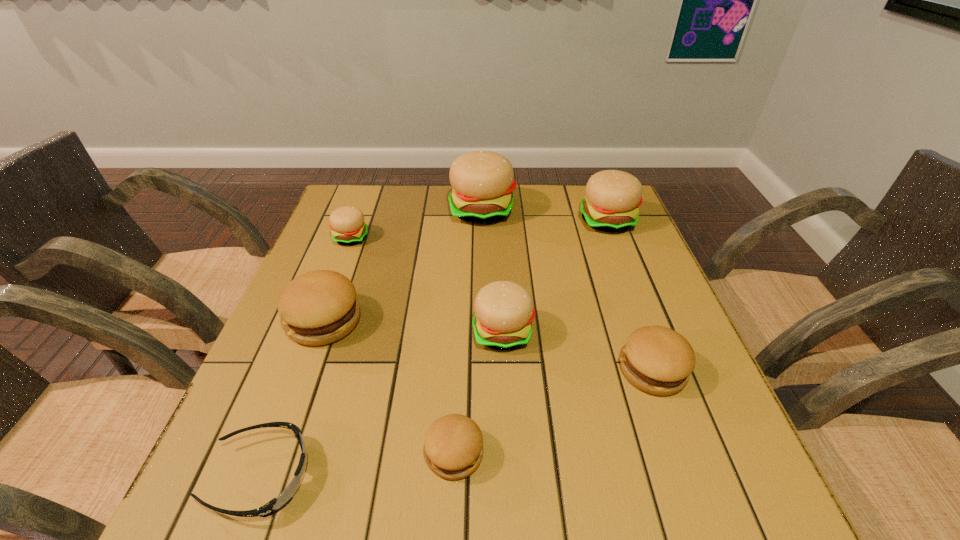
I want to click on sunglasses that is positioned at the near edge, so click(x=276, y=504).

The height and width of the screenshot is (540, 960). Find the location of `sunglasses that is at the left edge`. sunglasses that is at the left edge is located at coordinates (276, 504).

You are a GUI agent. You are given a task and a screenshot of the screen. Output one action in this format:
    pyautogui.click(x=<x>, y=<y>)
    Task: Click on the object that is at the near left corner
    This screenshot has height=540, width=960.
    Given the screenshot: What is the action you would take?
    pyautogui.click(x=276, y=504)

Locate an element on the screen. object positioned at the far right corner is located at coordinates (612, 200).

Locate an element on the screen. vacant region at the far edge of the desktop is located at coordinates (433, 212).

Image resolution: width=960 pixels, height=540 pixels. Find the location of `free region at the near edge`. free region at the near edge is located at coordinates (317, 477).

What are the coordinates of `free space at the left edge` in the screenshot? It's located at (329, 384).

Locate an element on the screen. vacant space at the right edge of the desktop is located at coordinates (646, 258).

You are a GUI agent. You are given a task and a screenshot of the screen. Output one action in this format:
    pyautogui.click(x=<x>, y=<y>)
    Task: Click on the free space at the far left corner of the desktop
    
    Given the screenshot: What is the action you would take?
    pyautogui.click(x=343, y=204)

Image resolution: width=960 pixels, height=540 pixels. In the image, there is a desktop. What are the coordinates of `vacant space at the near right corner` in the screenshot? It's located at (676, 492).